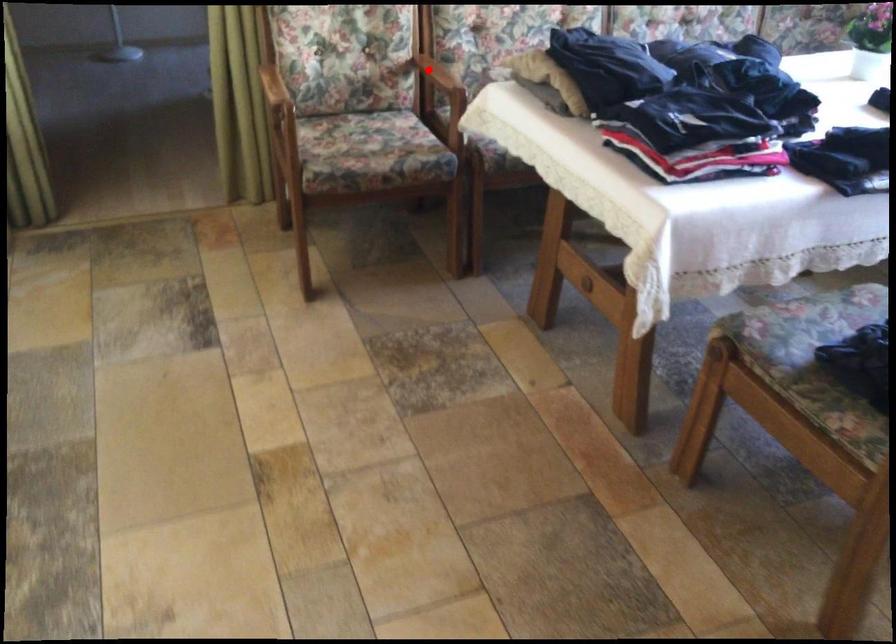
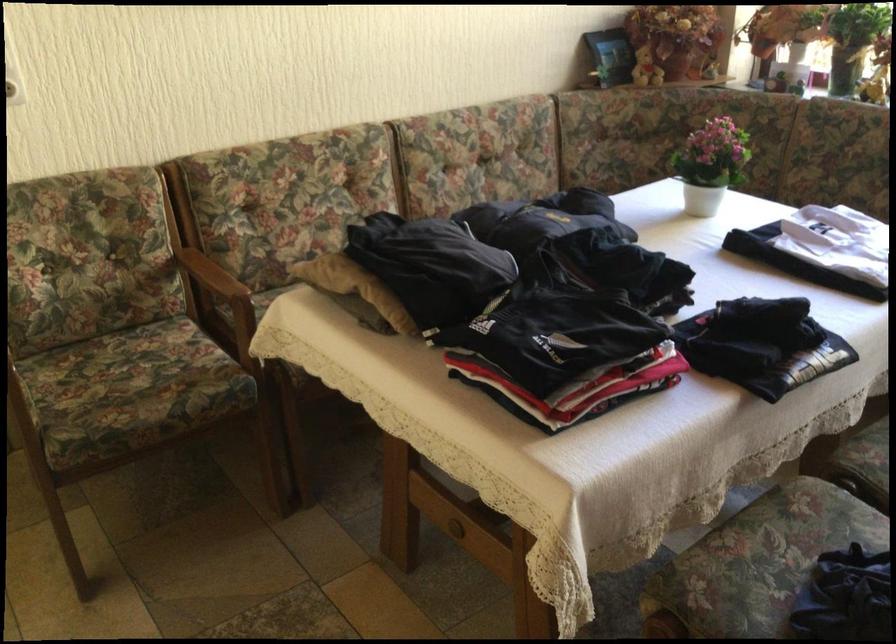
The point at the highlighted location is marked in the first image. Where is the corresponding point in the second image?

(204, 269)